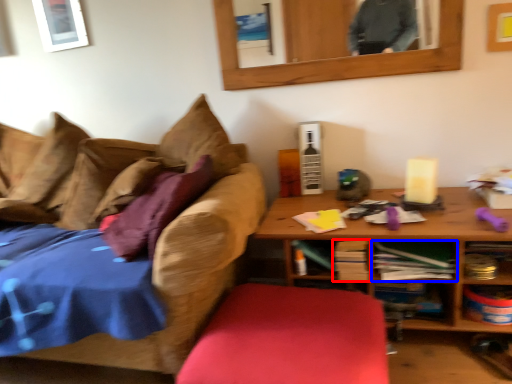
Question: Which point is further to the camera, book (highlighted by a red box) or book (highlighted by a blue box)?

Choices:
 (A) book
 (B) book

Answer: (A)